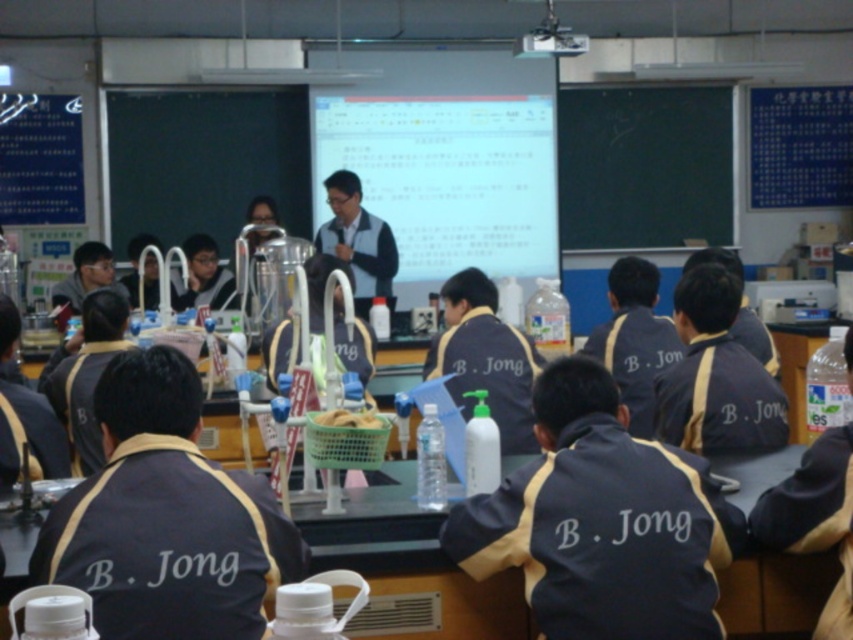
Question: Which object is farther from the camera taking this photo?

Choices:
 (A) dark blue fabric at center
 (B) white matte bottle at center
 (C) black chalkboard at upper center
 (D) dark blue shirt at center

Answer: (C)

Question: Considering the relative positions of dark blue fabric at center and black chalkboard at upper center in the image provided, where is dark blue fabric at center located with respect to black chalkboard at upper center?

Choices:
 (A) below
 (B) above

Answer: (A)

Question: Which point is farther to the camera?

Choices:
 (A) (384, 236)
 (B) (604, 92)

Answer: (B)

Question: Considering the real-world distances, which object is farthest from the dark blue fabric at center?

Choices:
 (A) dark blue shirt at center
 (B) black chalkboard at upper center

Answer: (B)

Question: From the image, what is the correct spatial relationship of white matte bottle at center in relation to black chalkboard at upper center?

Choices:
 (A) left
 (B) right

Answer: (A)

Question: Can you confirm if dark blue fabric at center is positioned above black chalkboard at upper center?

Choices:
 (A) no
 (B) yes

Answer: (A)